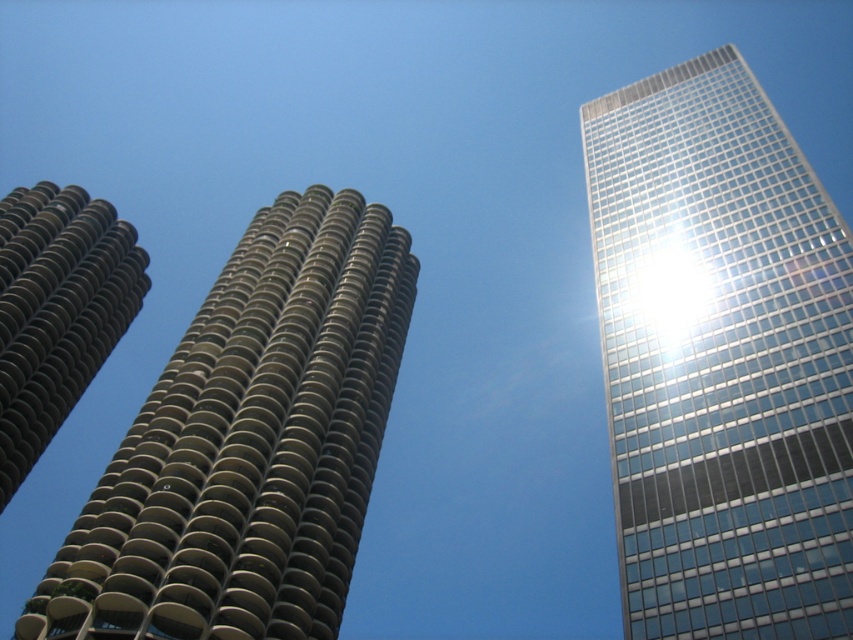
Question: Which point appears closest to the camera in this image?

Choices:
 (A) (672, 600)
 (B) (3, 220)

Answer: (A)

Question: Does transparent glass skyscraper at upper right appear over brown textured tower at left?

Choices:
 (A) yes
 (B) no

Answer: (A)

Question: Which object appears farthest from the camera in this image?

Choices:
 (A) transparent glass skyscraper at upper right
 (B) brown textured tower at left
 (C) brown concrete tower at left

Answer: (B)

Question: Among these points, which one is farthest from the camera?

Choices:
 (A) (107, 342)
 (B) (346, 356)

Answer: (A)

Question: Is brown concrete tower at left below brown textured tower at left?

Choices:
 (A) yes
 (B) no

Answer: (A)

Question: Does brown concrete tower at left appear on the right side of brown textured tower at left?

Choices:
 (A) no
 (B) yes

Answer: (B)